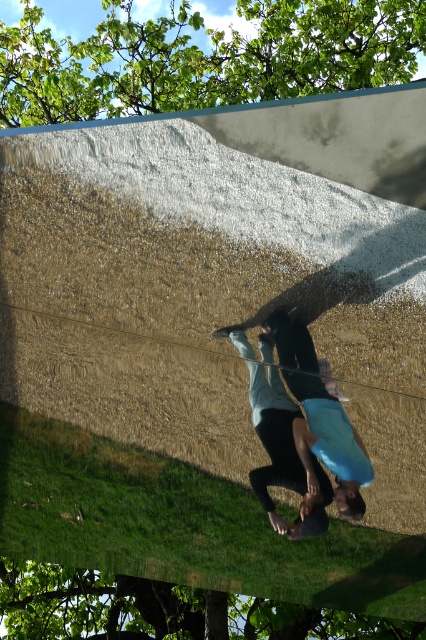
You are a photographer trying to capture a photo of the two people on the gravel path. To ensure both the green leafy tree at upper center and the blue matte surfboard at center are in the frame, which object should you position closer to the left side of your camera viewfinder?

The green leafy tree at upper center should be positioned closer to the left side of the camera viewfinder since it is already located to the left of the blue matte surfboard at center in the scene.

You are planning to take a photo of both the green leafy tree at upper center and the blue matte surfboard at center. Which object should you focus on first if you want to capture both in the same frame without moving the camera?

The green leafy tree at upper center is bigger than the blue matte surfboard at center, so you should focus on the green leafy tree at upper center first to ensure it fits properly in the frame before adjusting for the smaller surfboard.

Consider the image. You are a photographer trying to capture a photo of the two people on the gravel path. The green leafy tree at upper center is blocking part of the view. To avoid the tree, should you move left or right?

To avoid the green leafy tree at upper center, you should move either left or right, as the tree is located at the upper center of the image. Moving sideways could help position the subjects away from the tree.